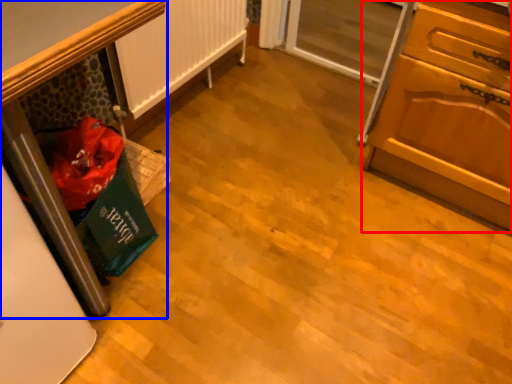
Question: Which point is further to the camera, cabinetry (highlighted by a red box) or furniture (highlighted by a blue box)?

Choices:
 (A) cabinetry
 (B) furniture

Answer: (B)